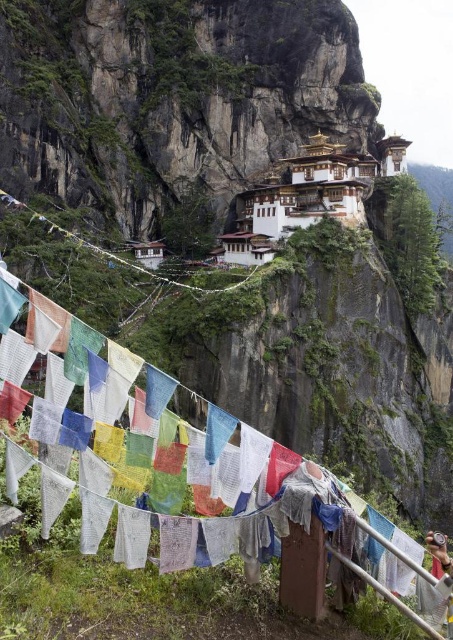
Question: Which point is closer to the camera?

Choices:
 (A) white painted stone building at upper center
 (B) colorful fabric clothesline at lower center

Answer: (B)

Question: Which point is farther to the camera?

Choices:
 (A) (321, 584)
 (B) (303, 225)

Answer: (B)

Question: Is colorful fabric clothesline at lower center to the left of white painted stone building at upper center from the viewer's perspective?

Choices:
 (A) yes
 (B) no

Answer: (A)

Question: Observing the image, what is the correct spatial positioning of colorful fabric clothesline at lower center in reference to white painted stone building at upper center?

Choices:
 (A) above
 (B) below

Answer: (B)

Question: Among these objects, which one is farthest from the camera?

Choices:
 (A) colorful fabric clothesline at lower center
 (B) white painted stone building at upper center

Answer: (B)

Question: Does colorful fabric clothesline at lower center come in front of white painted stone building at upper center?

Choices:
 (A) no
 (B) yes

Answer: (B)